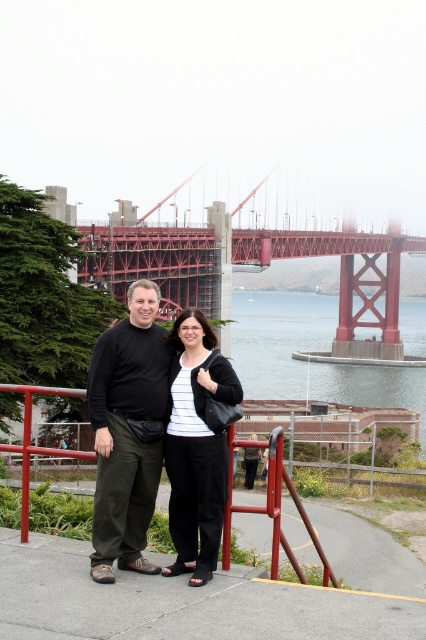
You are a photographer planning to take a photo of the clear water at center. The two people in the scene are standing 67.64 meters apart. If you want to ensure both are in the frame without any obstruction, what should you do?

The two people are 67.64 meters apart, so to include both in the frame without obstruction, you should use a wide angle lens to capture the entire scene.

You are a photographer trying to capture a photo of the clear water at center and the dark green pants at center. To ensure both are in focus, you need to know their relative positions. Which object is located to the left of the other?

The dark green pants at center is positioned on the left side of clear water at center, so the dark green pants at center is to the left of the clear water at center.